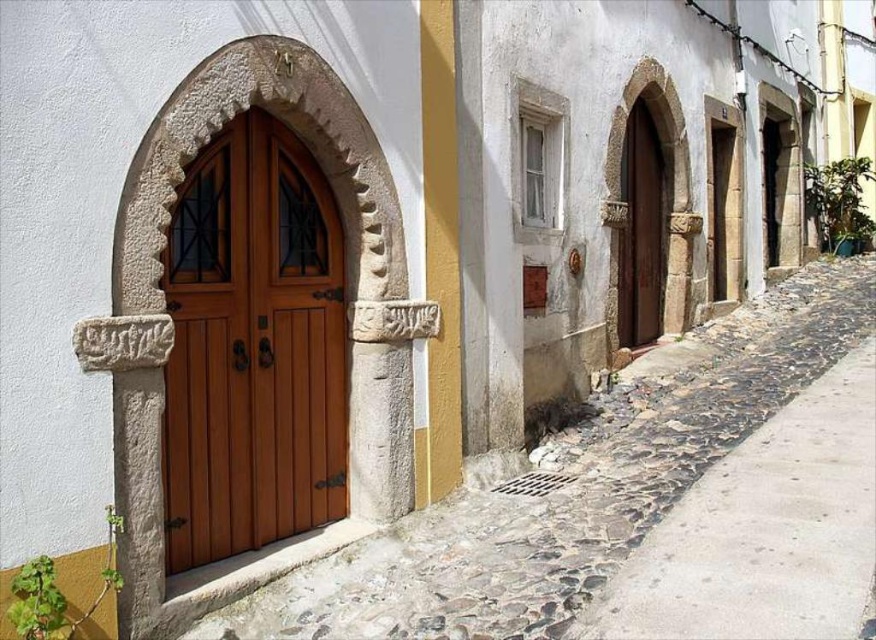
Question: Which point is closer to the camera?

Choices:
 (A) (648, 212)
 (B) (270, 618)
 (C) (288, 323)

Answer: (B)

Question: Does cobblestone alley at center appear on the right side of wooden door at center?

Choices:
 (A) yes
 (B) no

Answer: (A)

Question: Does wooden door at center lie behind brown wooden door at center?

Choices:
 (A) yes
 (B) no

Answer: (B)

Question: Among these objects, which one is farthest from the camera?

Choices:
 (A) cobblestone alley at center
 (B) brown wooden door at center

Answer: (B)

Question: Which point is farther to the camera?

Choices:
 (A) cobblestone alley at center
 (B) wooden door at center

Answer: (B)

Question: Does cobblestone alley at center appear over wooden door at center?

Choices:
 (A) yes
 (B) no

Answer: (B)